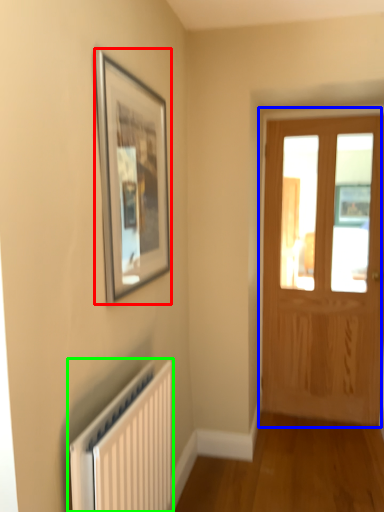
Question: Based on their relative distances, which object is nearer to picture frame (highlighted by a red box)? Choose from door (highlighted by a blue box) and radiator (highlighted by a green box).

Choices:
 (A) door
 (B) radiator

Answer: (B)